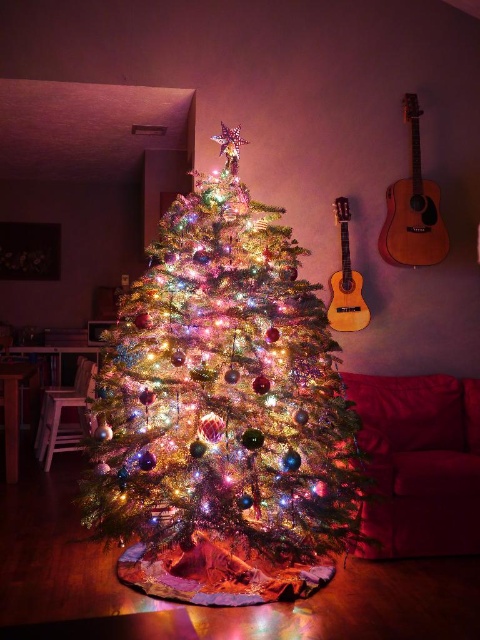
Does iridescent shiny tree at center have a lesser width compared to light brown wooden guitar at right?

No, iridescent shiny tree at center is not thinner than light brown wooden guitar at right.

Where is `iridescent shiny tree at center`? The image size is (480, 640). iridescent shiny tree at center is located at coordinates (224, 390).

Between point (187, 209) and point (428, 209), which one is positioned behind?

Positioned behind is point (428, 209).

Does iridescent shiny tree at center have a larger size compared to wooden acoustic guitar at right?

Correct, iridescent shiny tree at center is larger in size than wooden acoustic guitar at right.

Does point (175, 500) come behind point (427, 264)?

No, (175, 500) is closer to viewer.

The width and height of the screenshot is (480, 640). I want to click on iridescent shiny tree at center, so click(224, 390).

Does point (396, 211) come in front of point (327, 321)?

No, (396, 211) is behind (327, 321).

Find the location of a particular element. The width and height of the screenshot is (480, 640). wooden acoustic guitar at right is located at coordinates (412, 209).

Image resolution: width=480 pixels, height=640 pixels. Describe the element at coordinates (412, 209) in the screenshot. I see `wooden acoustic guitar at right` at that location.

Identify the location of wooden acoustic guitar at right. (412, 209).